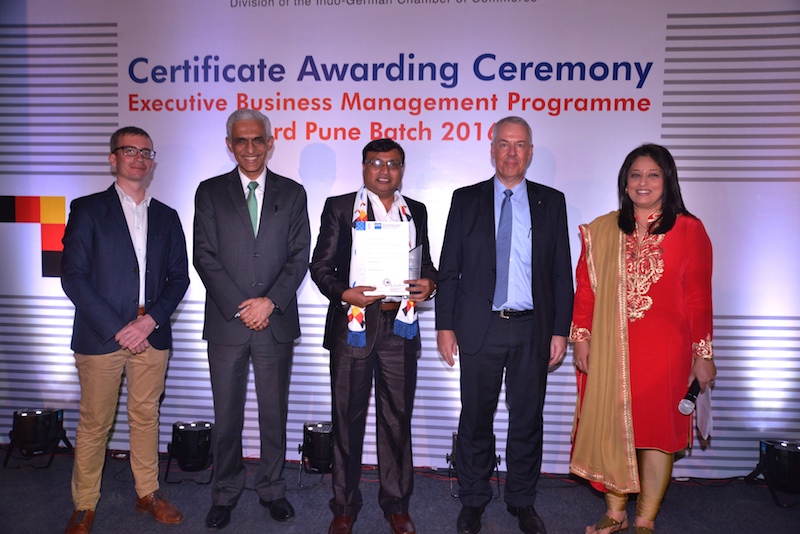
You are a GUI agent. You are given a task and a screenshot of the screen. Output one action in this format:
    pyautogui.click(x=<x>, y=<y>)
    Task: Click on the lights
    
    Given the screenshot: What is the action you would take?
    pyautogui.click(x=50, y=431)